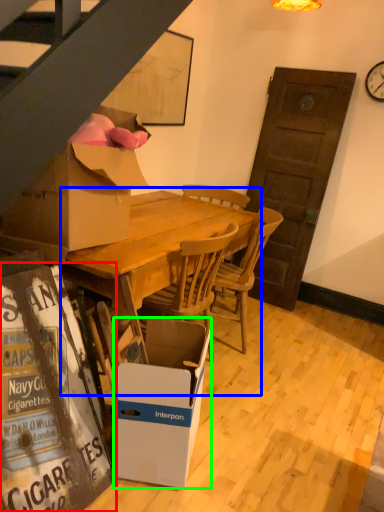
Question: Which object is the closest to the bulletin board (highlighted by a red box)? Choose among these: round table (highlighted by a blue box) or box (highlighted by a green box).

Choices:
 (A) round table
 (B) box

Answer: (B)